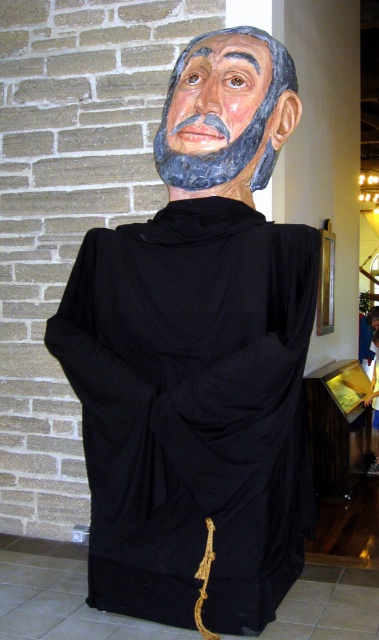
Can you confirm if matte black statue at center is shorter than matte black mask at upper center?

In fact, matte black statue at center may be taller than matte black mask at upper center.

Does matte black statue at center have a greater width compared to matte black mask at upper center?

Correct, the width of matte black statue at center exceeds that of matte black mask at upper center.

Is point (313, 284) less distant than point (258, 61)?

That is True.

At what (x,y) coordinates should I click in order to perform the action: click on matte black statue at center. Please return your answer as a coordinate pair (x, y). The height and width of the screenshot is (640, 379). Looking at the image, I should click on (198, 358).